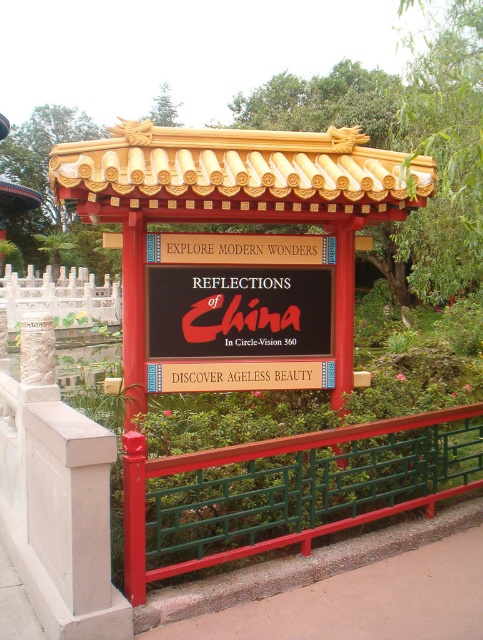
Question: Is black matte sign at center positioned behind white marble fence at center?

Choices:
 (A) no
 (B) yes

Answer: (A)

Question: Based on their relative distances, which object is nearer to the black matte sign at center?

Choices:
 (A) green metal fence at center
 (B) white marble fence at center

Answer: (A)

Question: Which object is positioned farthest from the white marble fence at center?

Choices:
 (A) green metal fence at center
 (B) black matte sign at center

Answer: (B)

Question: In this image, where is black matte sign at center located relative to white marble fence at center?

Choices:
 (A) below
 (B) above

Answer: (A)

Question: Which point is farther to the camera?

Choices:
 (A) black matte sign at center
 (B) green metal fence at center

Answer: (A)

Question: Is black matte sign at center further to camera compared to white marble fence at center?

Choices:
 (A) no
 (B) yes

Answer: (A)